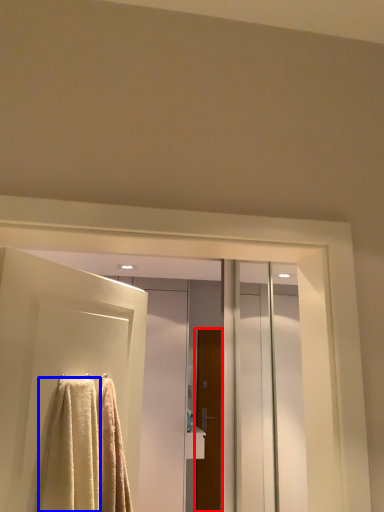
Question: Which of the following is the farthest to the observer, door (highlighted by a red box) or towel (highlighted by a blue box)?

Choices:
 (A) door
 (B) towel

Answer: (A)